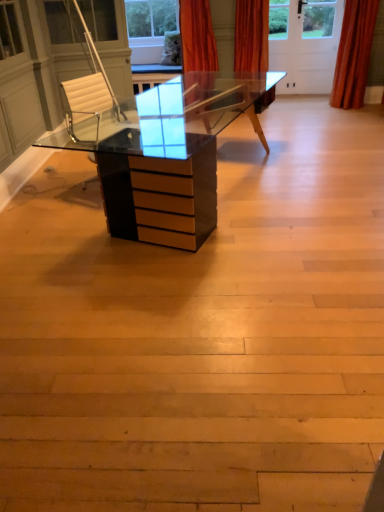
Question: Is orange velvet curtain at upper right, placed as the first curtain when sorted from right to left, inside orange velvet curtain at upper center, which is the first curtain from left to right?

Choices:
 (A) no
 (B) yes

Answer: (A)

Question: From the image's perspective, is orange velvet curtain at upper center, which is the first curtain from left to right, on orange velvet curtain at upper right, which appears as the 2th curtain when viewed from the left?

Choices:
 (A) no
 (B) yes

Answer: (B)

Question: Does orange velvet curtain at upper center, which ranks as the second curtain in right-to-left order, appear on the right side of orange velvet curtain at upper right, placed as the first curtain when sorted from right to left?

Choices:
 (A) no
 (B) yes

Answer: (A)

Question: Is orange velvet curtain at upper center, which is the first curtain from left to right, wider than orange velvet curtain at upper right, which appears as the 2th curtain when viewed from the left?

Choices:
 (A) no
 (B) yes

Answer: (B)

Question: Is orange velvet curtain at upper center, which is the first curtain from left to right, facing away from orange velvet curtain at upper right, which appears as the 2th curtain when viewed from the left?

Choices:
 (A) no
 (B) yes

Answer: (A)

Question: Is orange velvet curtain at upper center, which ranks as the second curtain in right-to-left order, further to the viewer compared to orange velvet curtain at upper right, which appears as the 2th curtain when viewed from the left?

Choices:
 (A) yes
 (B) no

Answer: (B)

Question: From the image's perspective, would you say orange velvet curtain at upper right, which appears as the 2th curtain when viewed from the left, is positioned over orange velvet curtain at upper center, which is the first curtain from left to right?

Choices:
 (A) yes
 (B) no

Answer: (B)

Question: Considering the relative positions of orange velvet curtain at upper right, which appears as the 2th curtain when viewed from the left, and orange velvet curtain at upper center, which is the first curtain from left to right, in the image provided, is orange velvet curtain at upper right, which appears as the 2th curtain when viewed from the left, to the left of orange velvet curtain at upper center, which is the first curtain from left to right, from the viewer's perspective?

Choices:
 (A) no
 (B) yes

Answer: (A)

Question: Is orange velvet curtain at upper right, which appears as the 2th curtain when viewed from the left, completely or partially outside of orange velvet curtain at upper center, which ranks as the second curtain in right-to-left order?

Choices:
 (A) yes
 (B) no

Answer: (A)

Question: Considering the relative sizes of orange velvet curtain at upper right, which appears as the 2th curtain when viewed from the left, and orange velvet curtain at upper center, which ranks as the second curtain in right-to-left order, in the image provided, is orange velvet curtain at upper right, which appears as the 2th curtain when viewed from the left, thinner than orange velvet curtain at upper center, which ranks as the second curtain in right-to-left order,?

Choices:
 (A) yes
 (B) no

Answer: (A)

Question: Does orange velvet curtain at upper right, which appears as the 2th curtain when viewed from the left, appear on the right side of orange velvet curtain at upper center, which is the first curtain from left to right?

Choices:
 (A) yes
 (B) no

Answer: (A)

Question: Is orange velvet curtain at upper right, placed as the first curtain when sorted from right to left, behind orange velvet curtain at upper center, which ranks as the second curtain in right-to-left order?

Choices:
 (A) yes
 (B) no

Answer: (A)

Question: From the image's perspective, is orange velvet curtain at upper right, placed as the first curtain when sorted from right to left, above or below orange velvet curtain at upper center, which ranks as the second curtain in right-to-left order?

Choices:
 (A) below
 (B) above

Answer: (A)